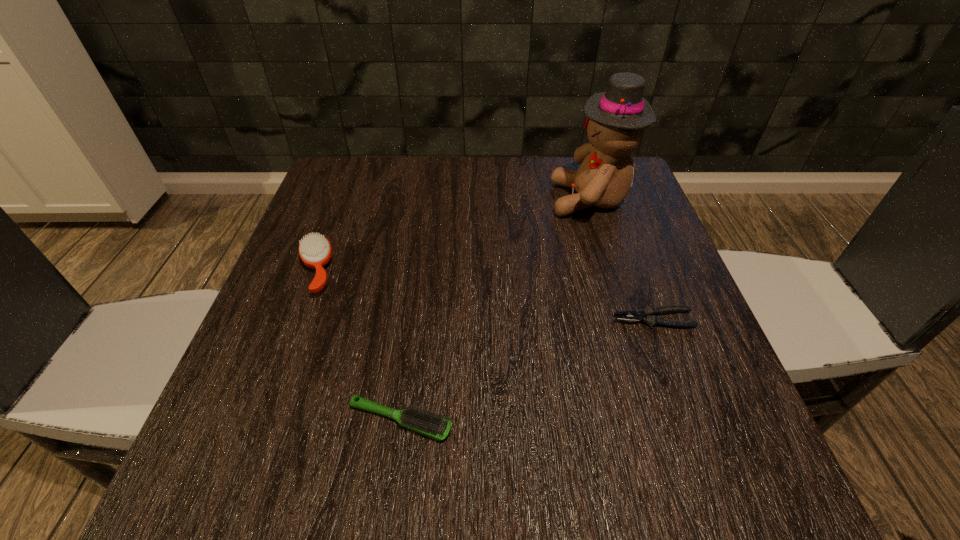
The width and height of the screenshot is (960, 540). I want to click on the farthest object, so click(x=615, y=119).

Locate an element on the screen. The width and height of the screenshot is (960, 540). the tallest object is located at coordinates (615, 119).

Find the location of a particular element. This screenshot has width=960, height=540. the leftmost object is located at coordinates (315, 251).

You are a GUI agent. You are given a task and a screenshot of the screen. Output one action in this format:
    pyautogui.click(x=<x>, y=<y>)
    Task: Click on the left hairbrush
    
    Given the screenshot: What is the action you would take?
    pyautogui.click(x=315, y=251)

At what (x,y) coordinates should I click in order to perform the action: click on the nearest object. Please return your answer as a coordinate pair (x, y). This screenshot has width=960, height=540. Looking at the image, I should click on 433,425.

Find the location of a particular element. the shorter hairbrush is located at coordinates (433, 425).

Image resolution: width=960 pixels, height=540 pixels. I want to click on the shortest object, so click(649, 315).

Locate an element on the screen. pliers is located at coordinates click(649, 315).

The height and width of the screenshot is (540, 960). In order to click on vacant space located 0.350m on the front-facing side of the farthest object in this screenshot , I will do `click(406, 200)`.

Find the location of a particular element. vacant space situated on the front-facing side of the farthest object is located at coordinates (530, 200).